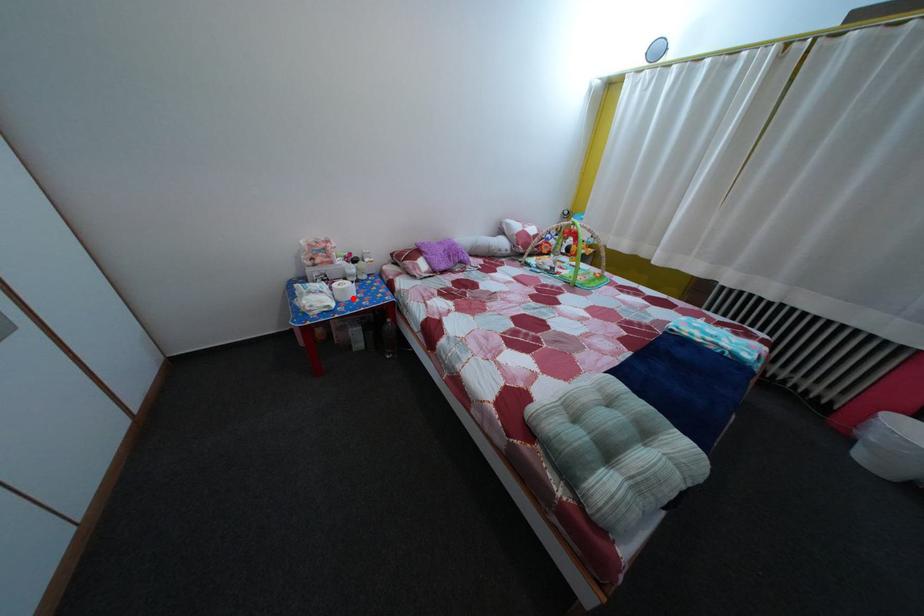
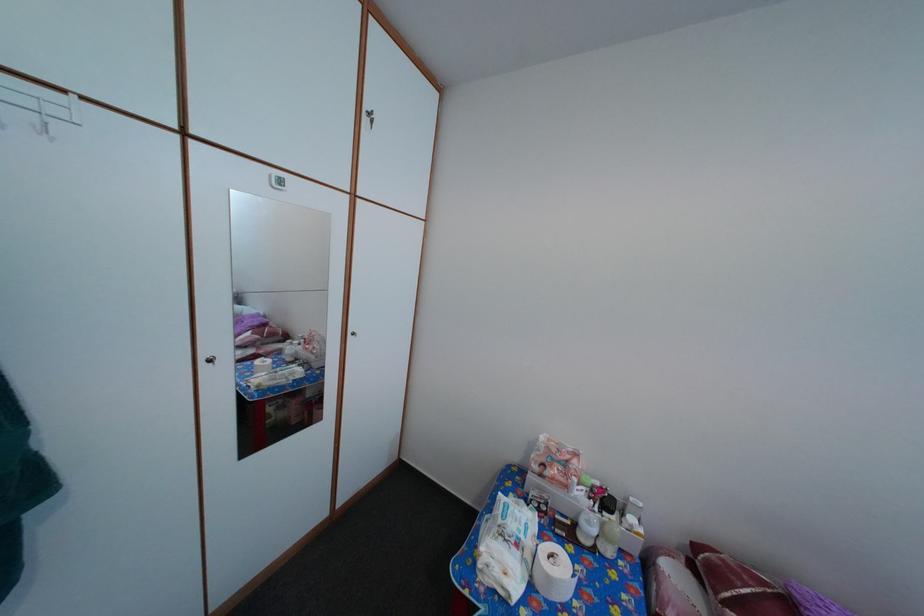
Question: I am providing you with two images of the same scene from different viewpoints. Given a red point in image1, look at the same physical point in image2. Is it:

Choices:
 (A) Closer to the viewpoint
 (B) Farther from the viewpoint

Answer: (B)